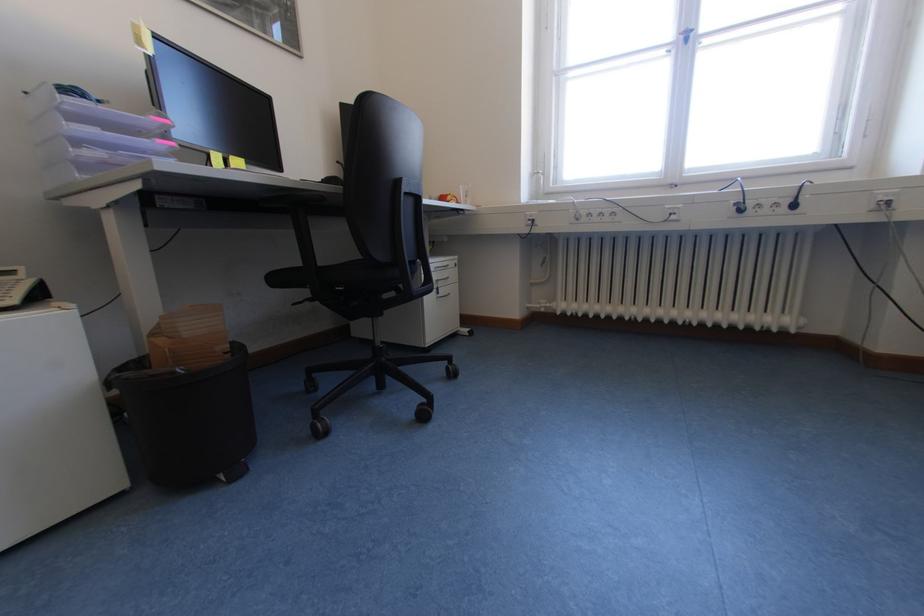
What do you see at coordinates (445, 290) in the screenshot?
I see `the cabinet handle` at bounding box center [445, 290].